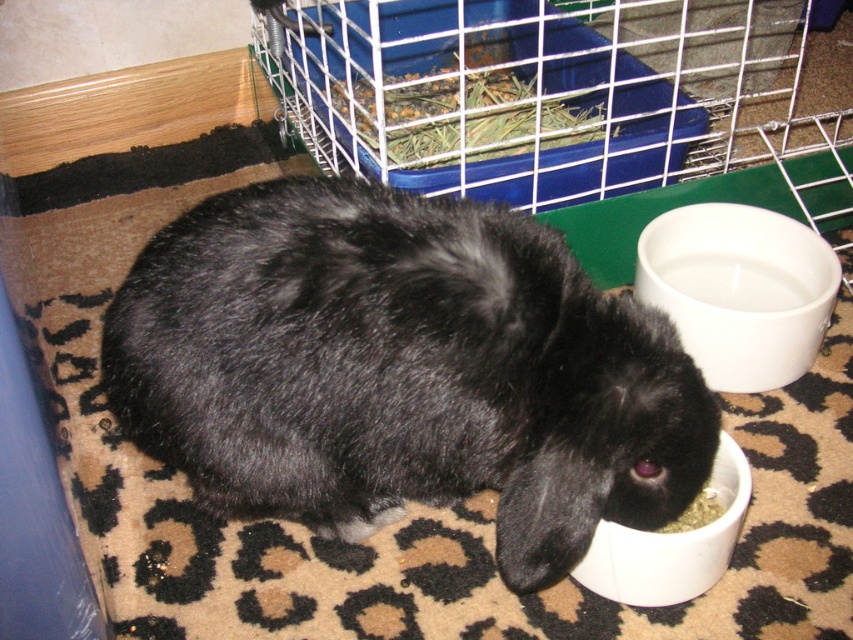
You are a pet owner who wants to place a new toy for your rabbit. The toy requires a minimum of 30 inches of space to be safely used. Based on the scene, can the black fur rabbit at center safely use the toy?

The black fur rabbit at center is 36.64 inches away from the viewer, which is more than the required 30 inches. Therefore, the rabbit can safely use the toy.

You are a pet owner who wants to place a new toy between the black fur rabbit at center and the white glossy bowl at lower center. Considering their sizes, which object should you place the toy closer to to ensure it doesn

The black fur rabbit at center is taller than the white glossy bowl at lower center. To ensure the toy is accessible to both, place it closer to the white glossy bowl at lower center since it is shorter.

You are a pet owner who wants to place a new toy in the area between the white glossy bowl at lower right and the white glossy bowl at lower center. Based on their positions, where should you place the toy to ensure it is between them?

→ The white glossy bowl at lower right is located above the white glossy bowl at lower center, so placing the toy between them would require positioning it below the white glossy bowl at lower right and above the white glossy bowl at lower center.